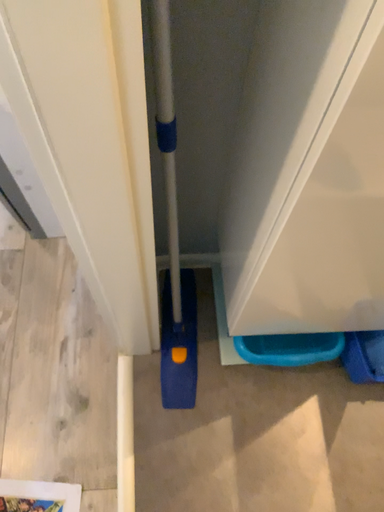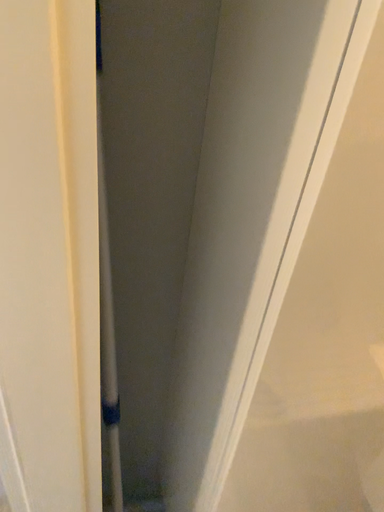
Question: How did the camera likely rotate when shooting the video?

Choices:
 (A) rotated left
 (B) rotated right

Answer: (B)